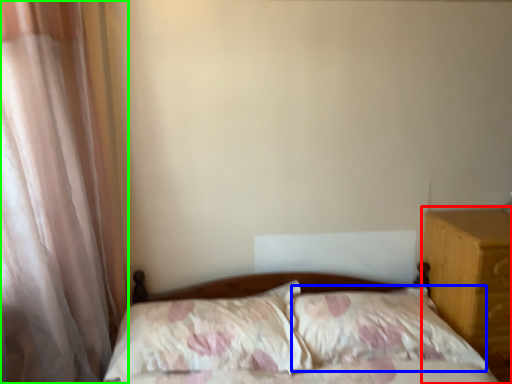
Question: Considering the real-world distances, which object is farthest from nightstand (highlighted by a red box)? pillow (highlighted by a blue box) or curtain (highlighted by a green box)?

Choices:
 (A) pillow
 (B) curtain

Answer: (B)